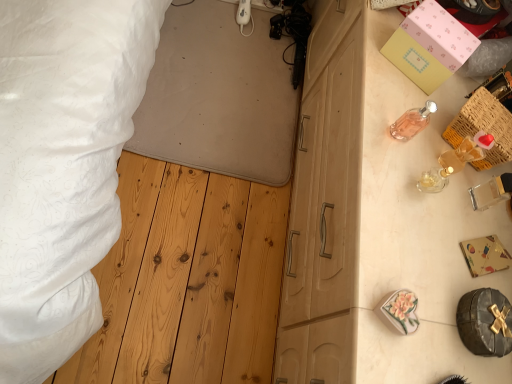
Question: In terms of size, does pink matte box at upper right, acting as the 1th box starting from the top, appear bigger or smaller than white textured bed at upper left?

Choices:
 (A) small
 (B) big

Answer: (A)

Question: In terms of height, does pink matte box at upper right, the second box positioned from the bottom, look taller or shorter compared to white textured bed at upper left?

Choices:
 (A) short
 (B) tall

Answer: (B)

Question: Which is nearer to the gold foil gift box at right, which ranks as the second box in top-to-bottom order?

Choices:
 (A) woven wood crate at upper right
 (B) pink matte box at upper right, the second box positioned from the bottom
 (C) pink glass perfume at upper right
 (D) white textured bed at upper left

Answer: (A)

Question: Which object is the farthest from the gold foil gift box at right, the 2th box viewed from the back?

Choices:
 (A) pink matte box at upper right, acting as the 1th box starting from the top
 (B) white textured bed at upper left
 (C) pink glass perfume at upper right
 (D) woven wood crate at upper right

Answer: (B)